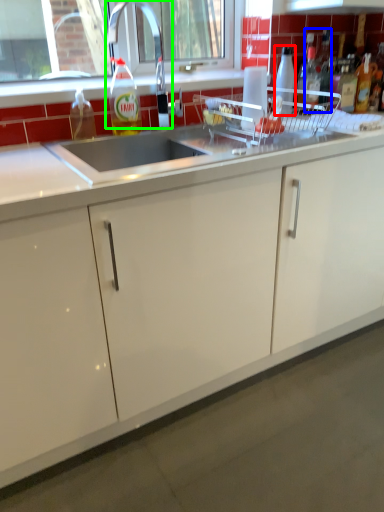
Question: Considering the real-world distances, which object is farthest from bottle (highlighted by a red box)? bottle (highlighted by a blue box) or faucet (highlighted by a green box)?

Choices:
 (A) bottle
 (B) faucet

Answer: (B)